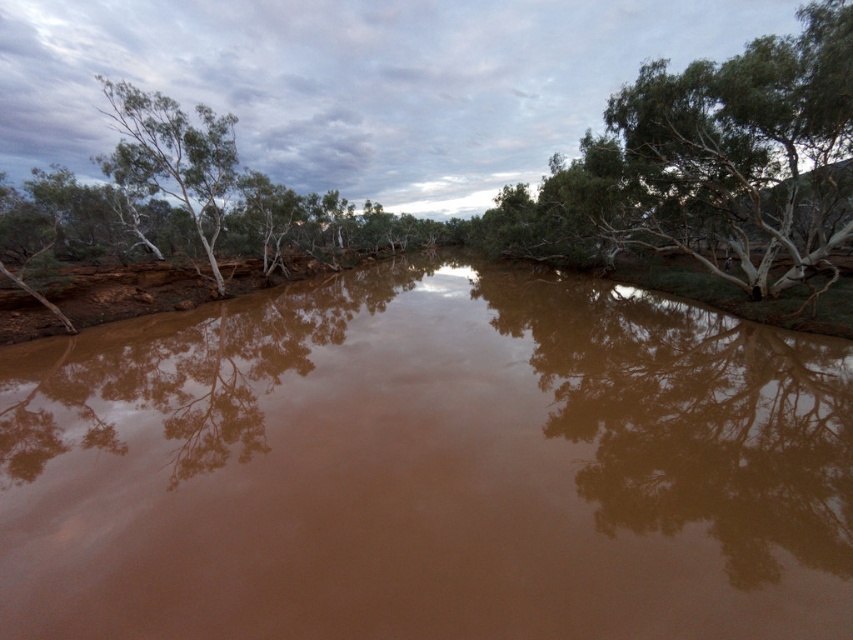
Question: Which of the following is the closest to the observer?

Choices:
 (A) (546, 476)
 (B) (840, 54)

Answer: (A)

Question: Does brown muddy water at center appear under green leafy tree at left?

Choices:
 (A) no
 (B) yes

Answer: (B)

Question: Does brown muddy water at center have a larger size compared to green leafy tree at center?

Choices:
 (A) yes
 (B) no

Answer: (B)

Question: Based on their relative distances, which object is farther from the brown muddy water at center?

Choices:
 (A) green leafy tree at left
 (B) green leafy tree at center

Answer: (A)

Question: Is brown muddy water at center to the left of green leafy tree at center from the viewer's perspective?

Choices:
 (A) no
 (B) yes

Answer: (B)

Question: Which of the following is the closest to the observer?

Choices:
 (A) (378, 273)
 (B) (148, 102)
 (C) (741, 188)

Answer: (C)